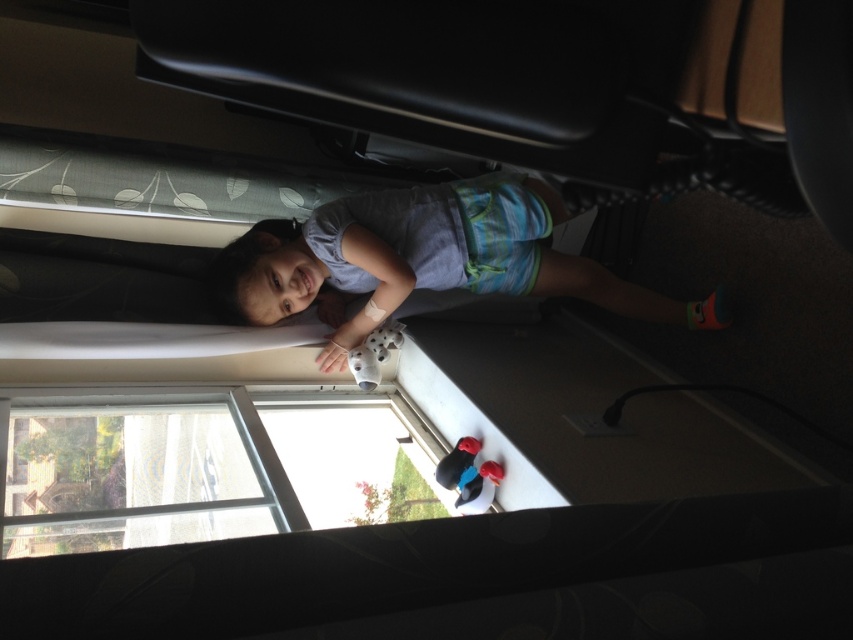
Question: Can you confirm if clear glass window at lower left is wider than rubberized plastic toy at lower center?

Choices:
 (A) yes
 (B) no

Answer: (A)

Question: Does light blue cotton shirt at upper center appear over clear glass window at lower left?

Choices:
 (A) yes
 (B) no

Answer: (A)

Question: Estimate the real-world distances between objects in this image. Which object is farther from the rubberized plastic toy at lower center?

Choices:
 (A) clear glass window at lower left
 (B) light blue cotton shirt at upper center

Answer: (A)

Question: Which point is closer to the camera?

Choices:
 (A) rubberized plastic toy at lower center
 (B) light blue cotton shirt at upper center
 (C) clear glass window at lower left

Answer: (C)

Question: Estimate the real-world distances between objects in this image. Which object is closer to the light blue cotton shirt at upper center?

Choices:
 (A) clear glass window at lower left
 (B) rubberized plastic toy at lower center

Answer: (A)

Question: Where is light blue cotton shirt at upper center located in relation to clear glass window at lower left in the image?

Choices:
 (A) above
 (B) below

Answer: (A)